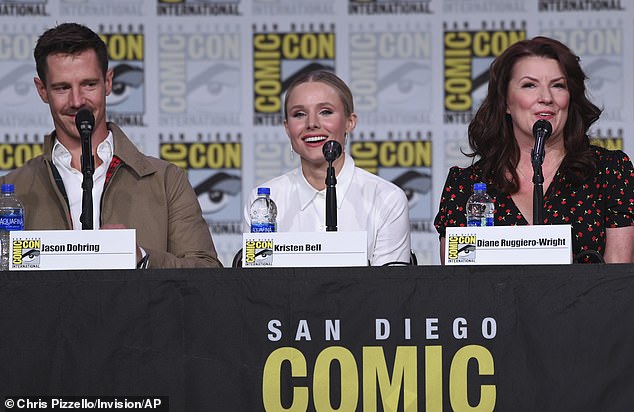
Where is `table clother`? The height and width of the screenshot is (412, 634). table clother is located at coordinates (246, 333).